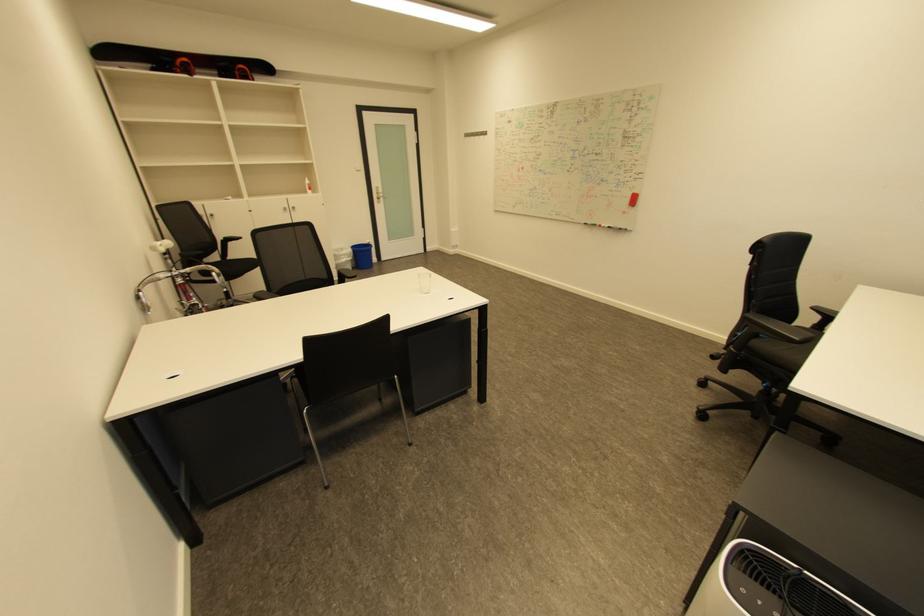
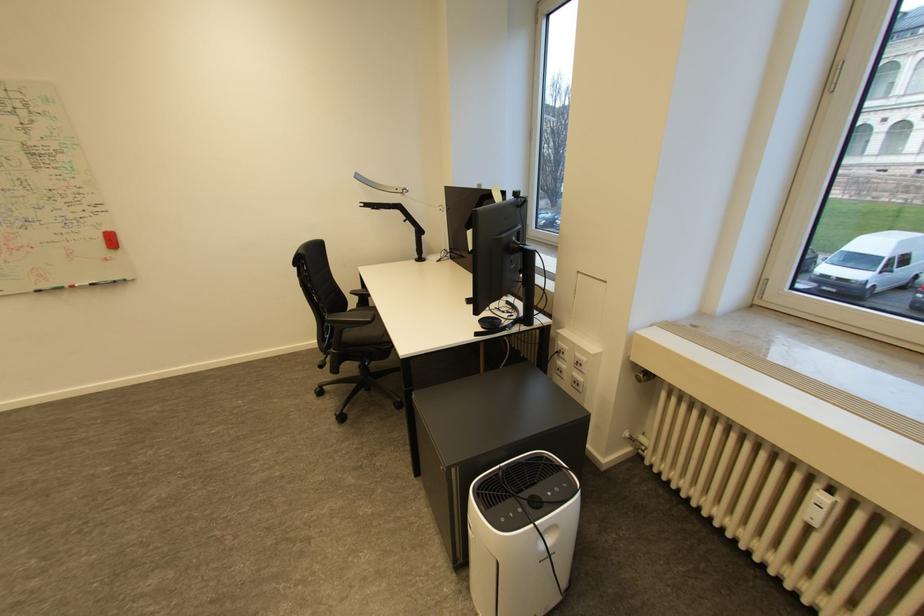
Locate, in the second image, the point that corresponds to the point at 800,325 in the first image.

(355, 310)